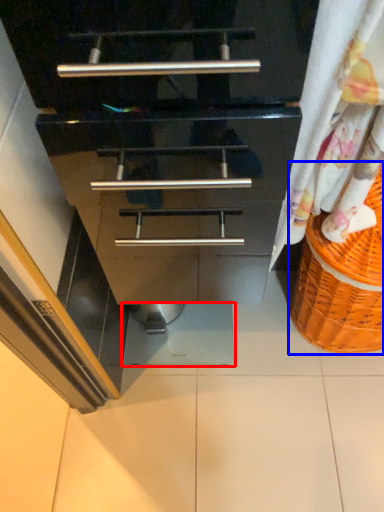
Question: Which object appears closest to the camera in this image, tile (highlighted by a red box) or basket (highlighted by a blue box)?

Choices:
 (A) tile
 (B) basket

Answer: (B)